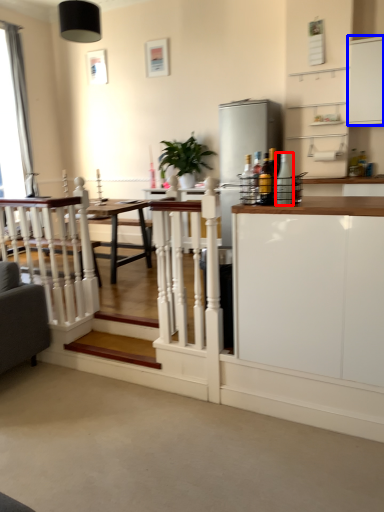
Question: Among these objects, which one is nearest to the camera, bottle (highlighted by a red box) or cabinetry (highlighted by a blue box)?

Choices:
 (A) bottle
 (B) cabinetry

Answer: (A)